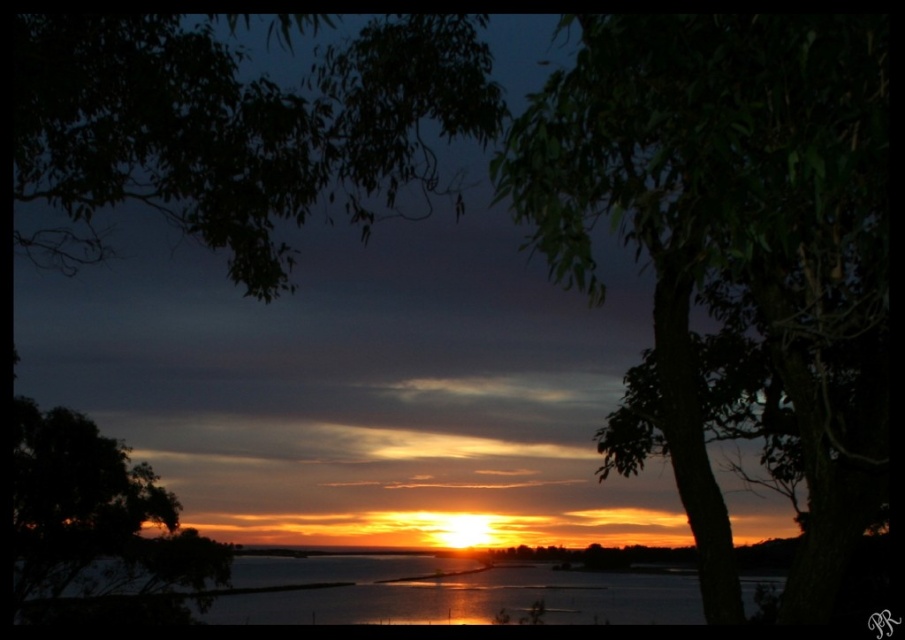
Does green leafy tree at upper right have a greater height compared to shiny reflective water at center?

No, green leafy tree at upper right is not taller than shiny reflective water at center.

Based on the photo, which is above, green leafy tree at upper right or shiny reflective water at center?

Positioned higher is green leafy tree at upper right.

Between point (854, 461) and point (226, 605), which one is positioned in front?

Positioned in front is point (854, 461).

The image size is (905, 640). I want to click on green leafy tree at upper right, so click(734, 237).

Which is behind, point (102, 74) or point (580, 580)?

The point (580, 580) is more distant.

Is dark green leafy tree at upper left smaller than shiny reflective water at center?

Yes.

You are a GUI agent. You are given a task and a screenshot of the screen. Output one action in this format:
    pyautogui.click(x=<x>, y=<y>)
    Task: Click on the dark green leafy tree at upper left
    The image size is (905, 640).
    Given the screenshot: What is the action you would take?
    pyautogui.click(x=232, y=129)

Measure the distance between green leafy tree at upper right and dark green leafy tree at lower left.

74.34 feet

Is green leafy tree at upper right behind dark green leafy tree at lower left?

No, green leafy tree at upper right is closer to the viewer.

Is point (722, 124) farther from camera compared to point (117, 451)?

No.

Where is `green leafy tree at upper right`? The width and height of the screenshot is (905, 640). green leafy tree at upper right is located at coordinates (x=734, y=237).